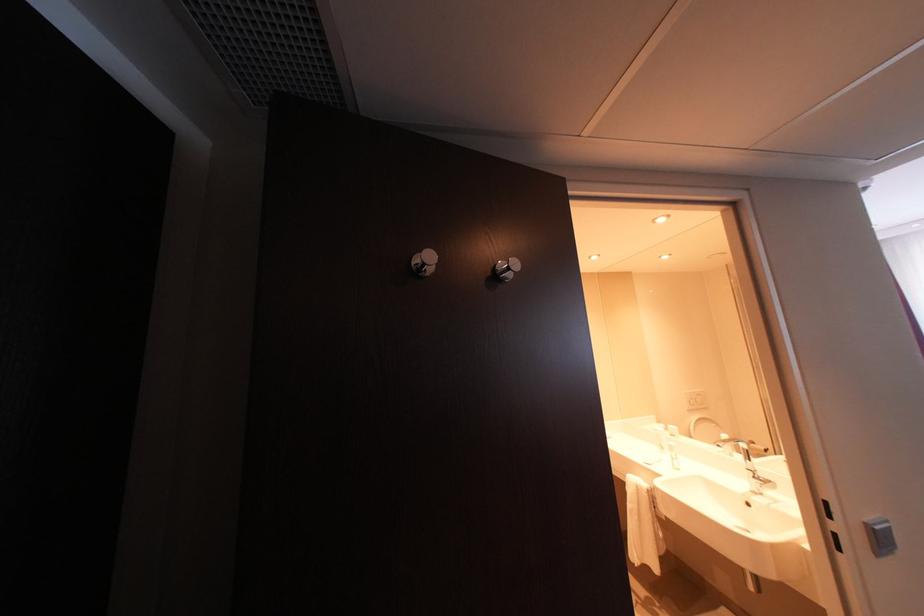
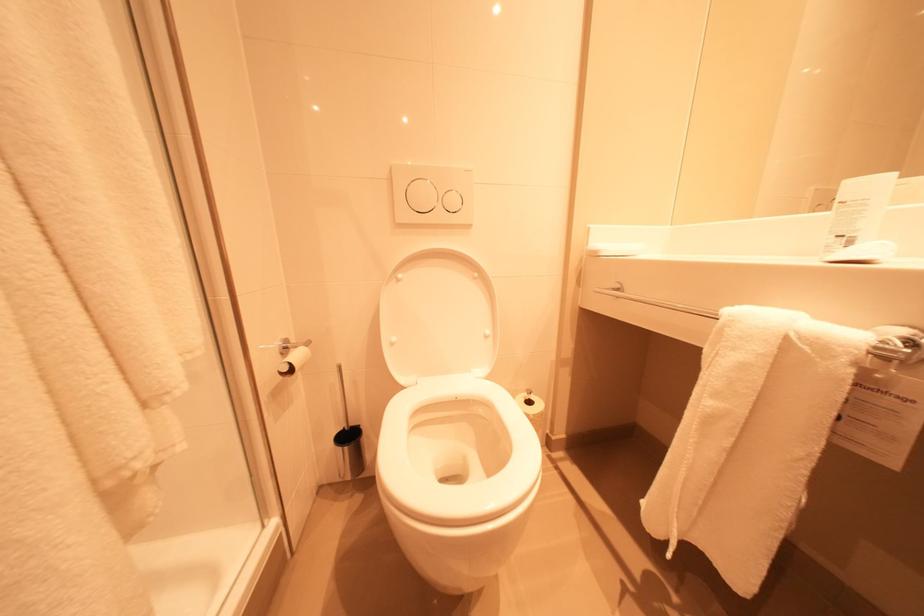
The images are taken continuously from a first-person perspective. In which direction are you moving?

The cameraman moved toward right, forward.